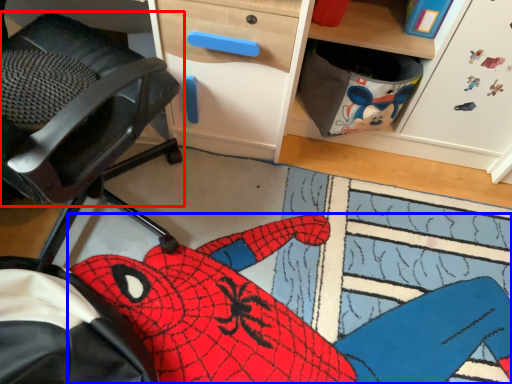
Question: Which of the following is the farthest to the observer, chair (highlighted by a red box) or animal (highlighted by a blue box)?

Choices:
 (A) chair
 (B) animal

Answer: (B)